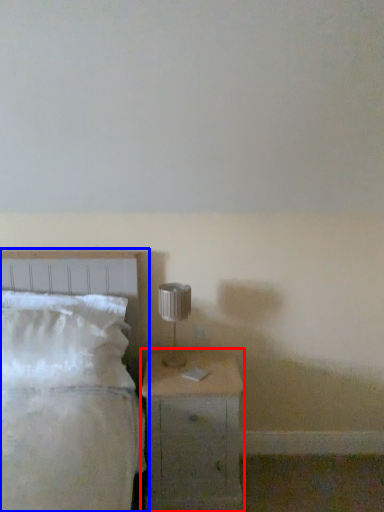
Question: Which of the following is the farthest to the observer, nightstand (highlighted by a red box) or bed (highlighted by a blue box)?

Choices:
 (A) nightstand
 (B) bed

Answer: (A)